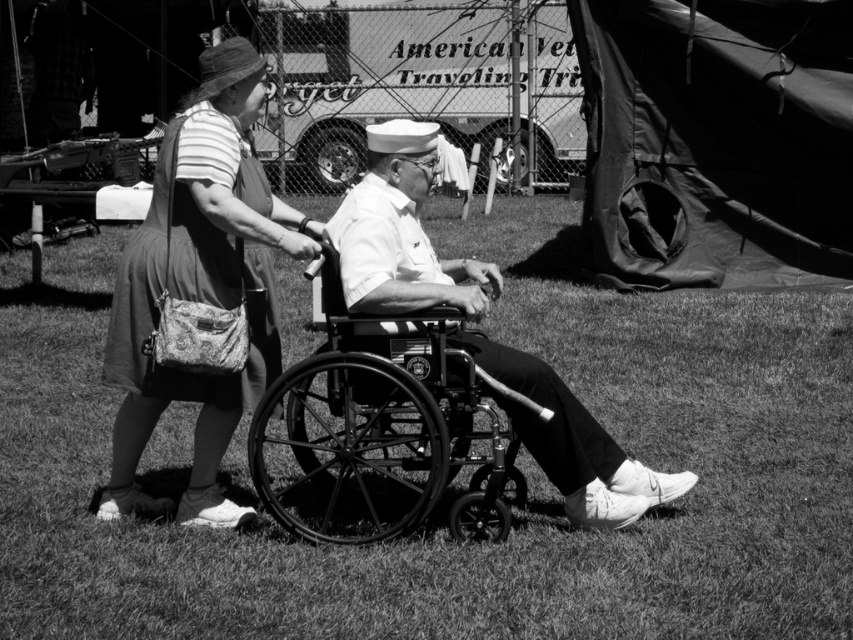
You are a photographer who wants to capture a closeup of both the grass at center and the matte fabric dress at center in the scene. Given that your camera can only focus on objects within a 5 feet range, will you be able to photograph both subjects at the same time?

The grass at center and matte fabric dress at center are 5.40 feet apart. Since the distance between them exceeds the camera focus range of 5 feet, you cannot photograph both subjects simultaneously.

You are standing at a point 5 meters away from the scene described. Can you reach the point marked by the coordinates point (x=299, y=246) without moving closer than 4 meters to the scene?

The distance of point (x=299, y=246) from viewer is 4.66 meters, so yes, you can reach the point marked by the coordinates point (x=299, y=246) without moving closer than 4 meters to the scene since it is exactly 4.66 meters away.